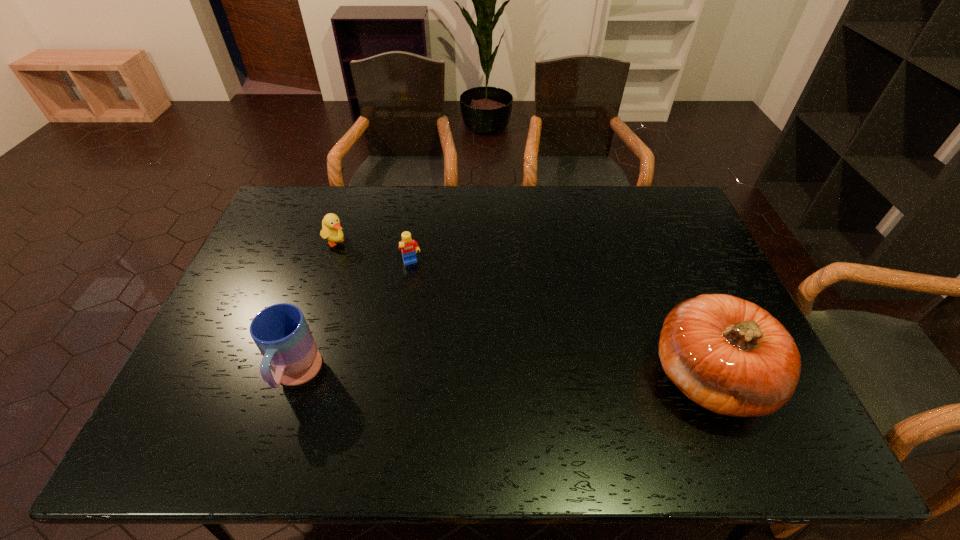
Where is `vacant area that lies between the mug and the duckling`? The height and width of the screenshot is (540, 960). vacant area that lies between the mug and the duckling is located at coordinates (316, 309).

Identify the location of vacant area that lies between the duckling and the second tallest object. The height and width of the screenshot is (540, 960). (316, 309).

The height and width of the screenshot is (540, 960). Identify the location of free space between the tallest object and the second object from right to left. (560, 320).

The height and width of the screenshot is (540, 960). In order to click on object that stands as the closest to the rightmost object in this screenshot , I will do `click(409, 247)`.

I want to click on the closest object relative to the duckling, so click(x=409, y=247).

In order to click on free space that satisfies the following two spatial constraints: 1. on the front side of the third object from left to right; 2. on the left side of the rightmost object in this screenshot , I will do `click(395, 377)`.

Image resolution: width=960 pixels, height=540 pixels. What are the coordinates of `vacant space that satisfies the following two spatial constraints: 1. on the side of the tallest object with the handle; 2. on the left side of the third shortest object` in the screenshot? It's located at (295, 377).

I want to click on free spot that satisfies the following two spatial constraints: 1. on the side of the tallest object with the handle; 2. on the left side of the mug, so click(295, 377).

You are a GUI agent. You are given a task and a screenshot of the screen. Output one action in this format:
    pyautogui.click(x=<x>, y=<y>)
    Task: Click on the vacant space that satisfies the following two spatial constraints: 1. on the side of the rightmost object with the handle; 2. on the left side of the second tallest object
    The image size is (960, 540).
    Given the screenshot: What is the action you would take?
    pyautogui.click(x=295, y=377)